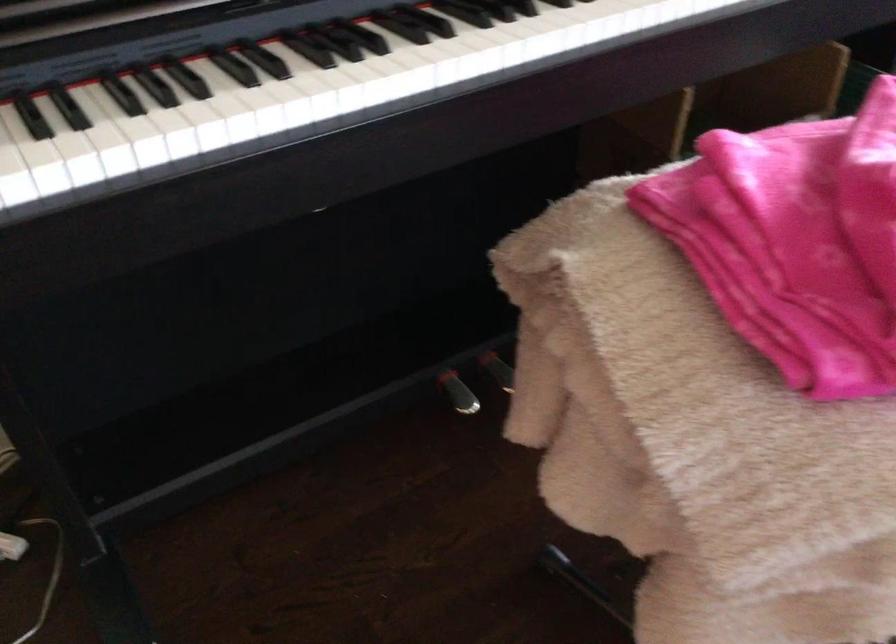
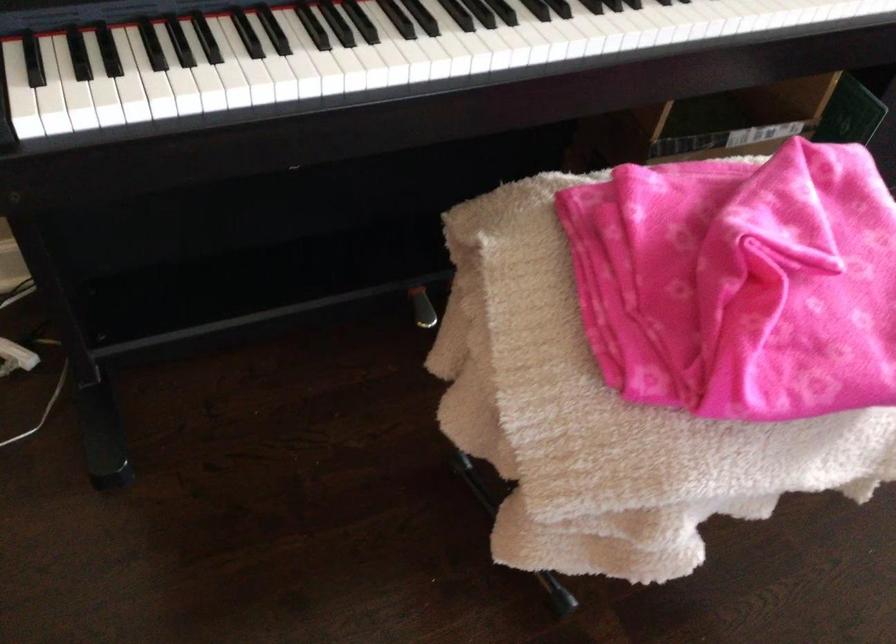
The point at (747, 428) is marked in the first image. Where is the corresponding point in the second image?

(571, 406)